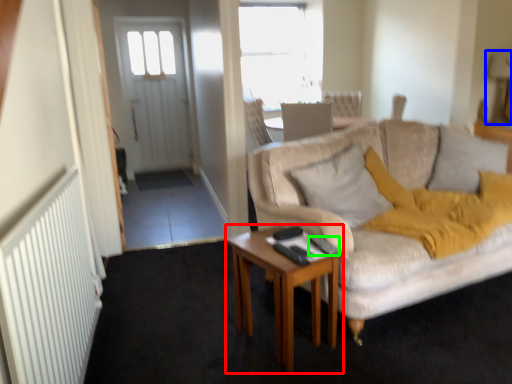
Question: Estimate the real-world distances between objects in this image. Which object is farther from desk (highlighted by a red box), lamp (highlighted by a blue box) or remote control (highlighted by a green box)?

Choices:
 (A) lamp
 (B) remote control

Answer: (A)